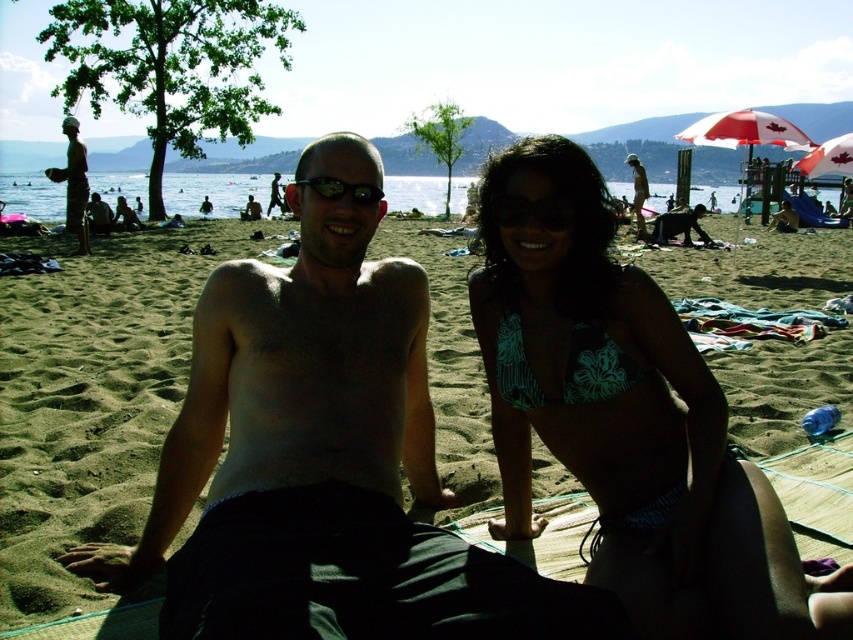
You are a photographer trying to capture the two people in the scene. The person on the left is shirtless and wearing dark swim shorts, while the person on the right is in a green and white patterned bikini top and dark bottoms. You want to focus your camera on the point at coordinates point (564, 365). Which person should you adjust your focus to ensure the point is clearly visible?

The point (564, 365) is on the green floral bikini top at center, so you should focus on the person on the right wearing the green and white patterned bikini top and dark bottoms to ensure the point is clearly visible.

Consider the image. You are a photographer trying to capture a closeup shot of the black plastic sunglasses at center and the light brown wooden surfboard at center. If your camera lens can only focus on objects within a 10 cm width, will both items fit in the frame?

The black plastic sunglasses at center has a lesser width compared to light brown wooden surfboard at center. Since the sunglasses are narrower, they might fit within the 10 cm width, but the surfboard is wider and may exceed the frame. Therefore, only the sunglasses would fit, not the surfboard.